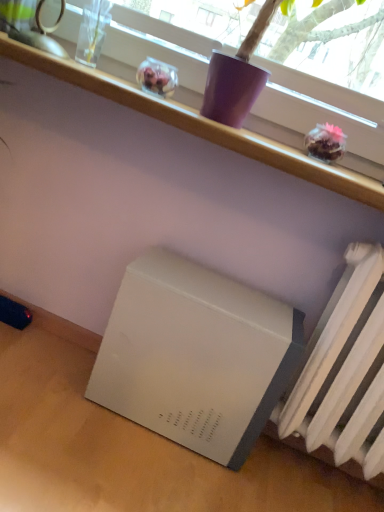
Question: Does white plastic shelf at upper center have a smaller size compared to white matte radiator at lower right?

Choices:
 (A) yes
 (B) no

Answer: (A)

Question: Does white plastic shelf at upper center come behind white matte radiator at lower right?

Choices:
 (A) yes
 (B) no

Answer: (A)

Question: Can you confirm if white plastic shelf at upper center is positioned to the left of white matte radiator at lower right?

Choices:
 (A) yes
 (B) no

Answer: (A)

Question: From the image's perspective, is white plastic shelf at upper center below white matte radiator at lower right?

Choices:
 (A) yes
 (B) no

Answer: (B)

Question: Does white plastic shelf at upper center have a lesser height compared to white matte radiator at lower right?

Choices:
 (A) yes
 (B) no

Answer: (A)

Question: Is white plastic shelf at upper center wider than white matte radiator at lower right?

Choices:
 (A) no
 (B) yes

Answer: (B)

Question: Can you confirm if white matte radiator at lower right is positioned to the right of white matte table at lower right?

Choices:
 (A) yes
 (B) no

Answer: (A)

Question: Is the surface of white matte radiator at lower right in direct contact with white matte table at lower right?

Choices:
 (A) no
 (B) yes

Answer: (A)

Question: Does white matte radiator at lower right lie behind white matte table at lower right?

Choices:
 (A) no
 (B) yes

Answer: (B)

Question: Is white matte radiator at lower right in front of white matte table at lower right?

Choices:
 (A) no
 (B) yes

Answer: (A)

Question: Is white matte radiator at lower right shorter than white matte table at lower right?

Choices:
 (A) yes
 (B) no

Answer: (B)

Question: Does white matte radiator at lower right have a greater width compared to white matte table at lower right?

Choices:
 (A) no
 (B) yes

Answer: (A)

Question: Is white matte refrigerator at lower left inside white plastic shelf at upper center?

Choices:
 (A) no
 (B) yes

Answer: (A)